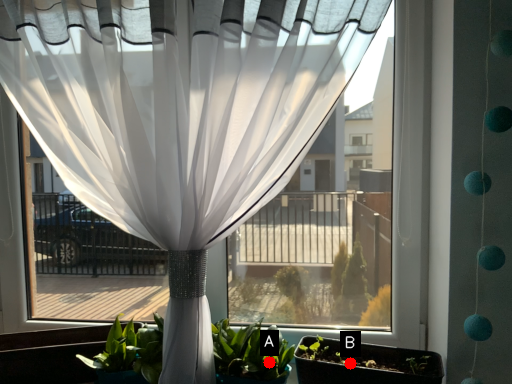
Question: Two points are circled on the image, labeled by A and B beside each circle. Which point is farther to the camera?

Choices:
 (A) A is further
 (B) B is further

Answer: (B)